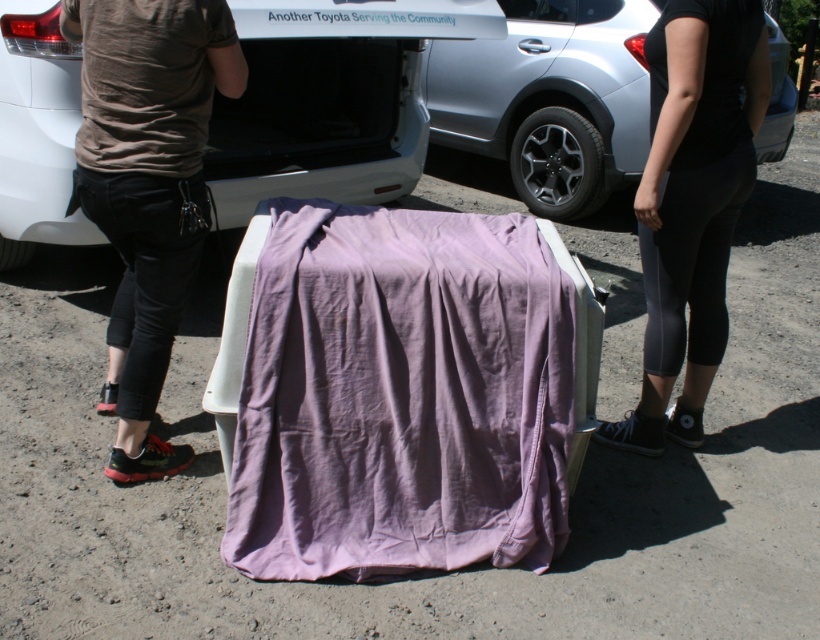
You are a delivery person who needs to place a package between the purple cotton blanket at center and the white matte car at center. The package requires at least 1.5 meters of space to be safely placed. Can you fit it in the available space?

The purple cotton blanket at center is 1.90 meters away from the white matte car at center. Since the required space is 1.5 meters, the package can be safely placed between them as there is enough space.

Looking at this image, you are standing in the outdoor scene and want to walk from the white matte car at center to the black fabric pants at lower right. Which direction should you move relative to the car?

You should move away from the white matte car at center towards the black fabric pants at lower right since the car is closer to you than the pants.

You are standing at the center of the image and want to place a new object exactly at the point marked by the coordinates point (399, 396). What object is already located at that position?

The point (399, 396) indicates the location of the purple cotton blanket at center.